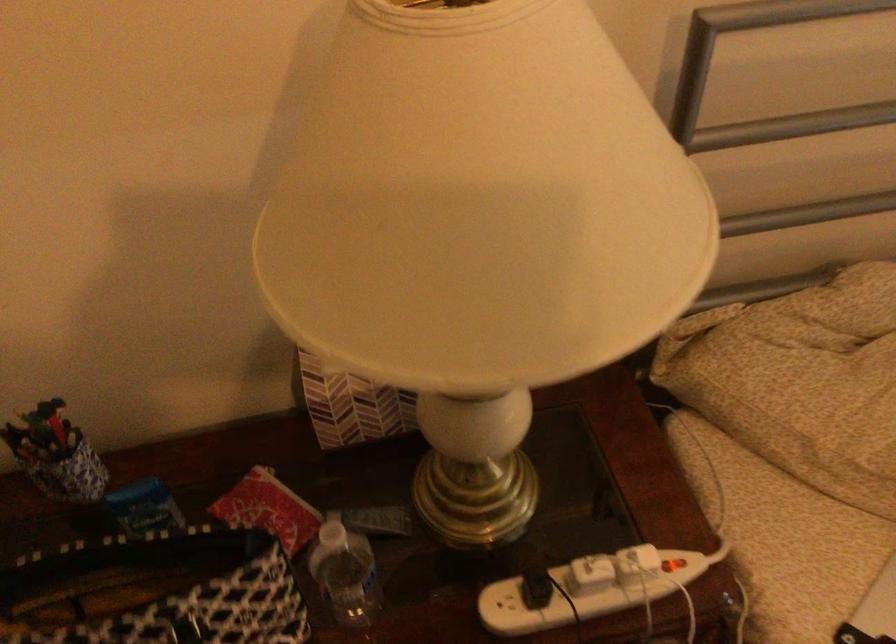
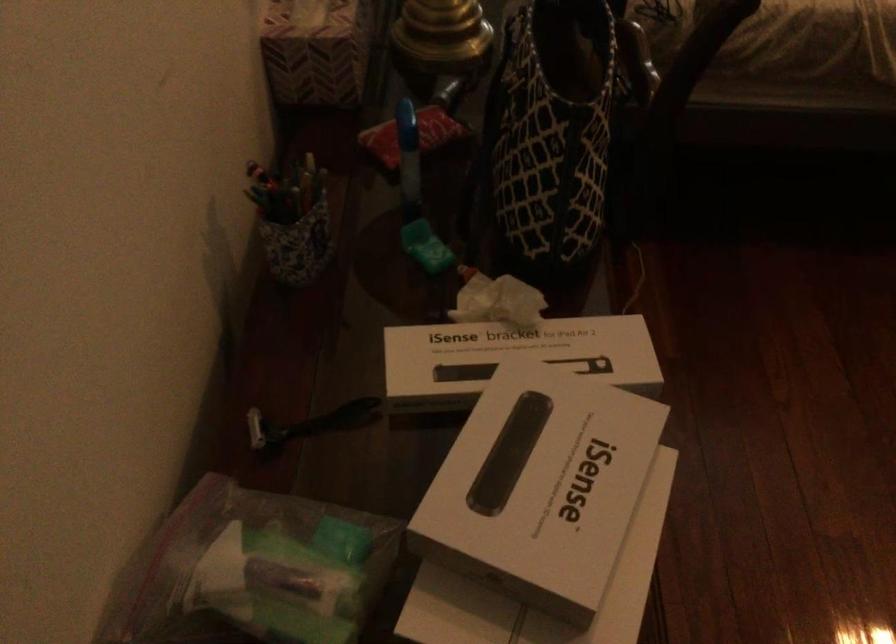
The point at (x=298, y=384) is marked in the first image. Where is the corresponding point in the second image?

(315, 51)